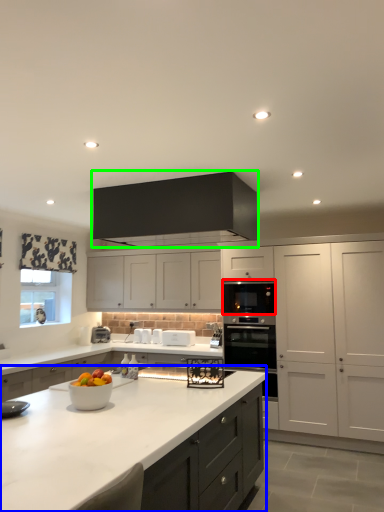
Question: Based on their relative distances, which object is nearer to oven (highlighted by a red box)? Choose from countertop (highlighted by a blue box) and cabinetry (highlighted by a green box).

Choices:
 (A) countertop
 (B) cabinetry

Answer: (B)